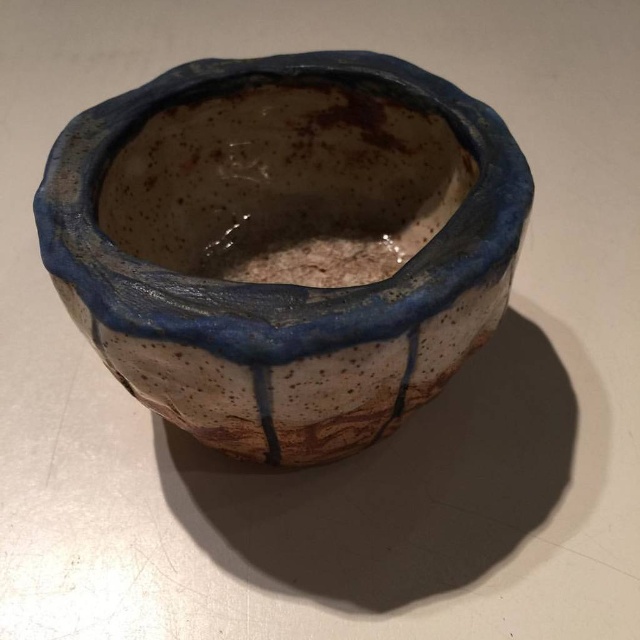
You are an interior designer arranging items on a shelf. You have a speckled ceramic pot at center and a speckled clay pot at center. Which one has a larger width?

The speckled ceramic pot at center has a larger width than the speckled clay pot at center according to the description.

You are an art appraiser examining two pots in the image. The speckled ceramic pot at center and the speckled clay pot at center. Which one is positioned closer to you?

The speckled ceramic pot at center is closer to the viewer than the speckled clay pot at center.